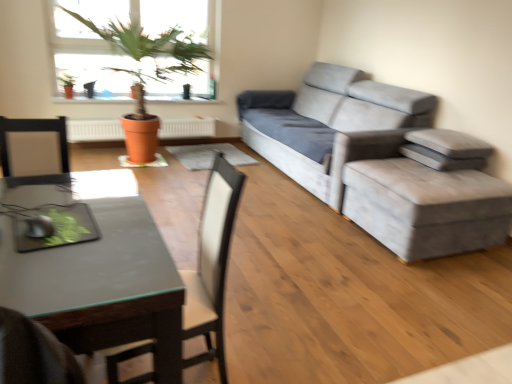
The width and height of the screenshot is (512, 384). I want to click on vacant space in front of velvet grey stool at right, so click(434, 288).